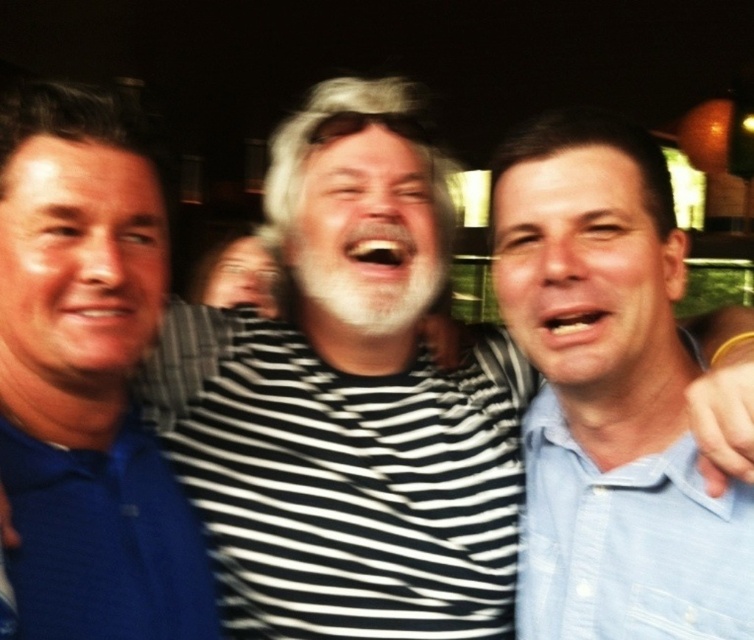
Does point (601, 444) lie in front of point (592, 516)?

No.

Who is higher up, light blue shirt at center or light blue cotton shirt at right?

light blue shirt at center is above.

At what (x,y) coordinates should I click in order to perform the action: click on light blue shirt at center. Please return your answer as a coordinate pair (x, y). The width and height of the screenshot is (754, 640). Looking at the image, I should click on (608, 394).

You are a GUI agent. You are given a task and a screenshot of the screen. Output one action in this format:
    pyautogui.click(x=<x>, y=<y>)
    Task: Click on the light blue shirt at center
    
    Given the screenshot: What is the action you would take?
    pyautogui.click(x=608, y=394)